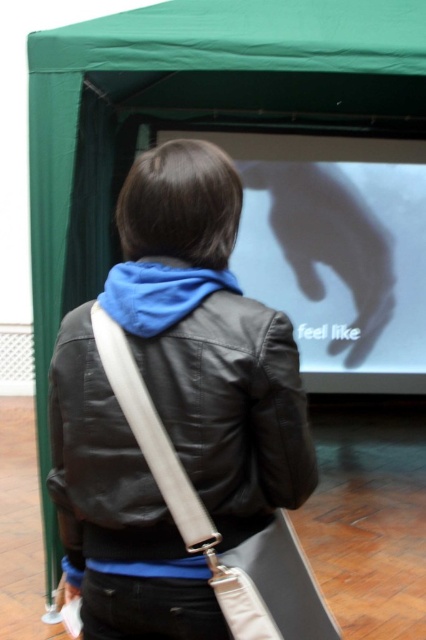
Question: Does black leather jacket at center come in front of white glossy projection screen at center?

Choices:
 (A) no
 (B) yes

Answer: (B)

Question: Which object appears closest to the camera in this image?

Choices:
 (A) black leather jacket at center
 (B) white glossy projection screen at center

Answer: (A)

Question: Does black leather jacket at center appear on the left side of blue fleece scarf at upper center?

Choices:
 (A) yes
 (B) no

Answer: (A)

Question: In this image, where is black leather jacket at center located relative to white glossy projection screen at center?

Choices:
 (A) above
 (B) below

Answer: (B)

Question: Which point appears closest to the camera in this image?

Choices:
 (A) (173, 435)
 (B) (112, 304)
 (C) (322, 179)

Answer: (A)

Question: Considering the real-world distances, which object is closest to the black leather jacket at center?

Choices:
 (A) blue fleece scarf at upper center
 (B) white glossy projection screen at center

Answer: (A)